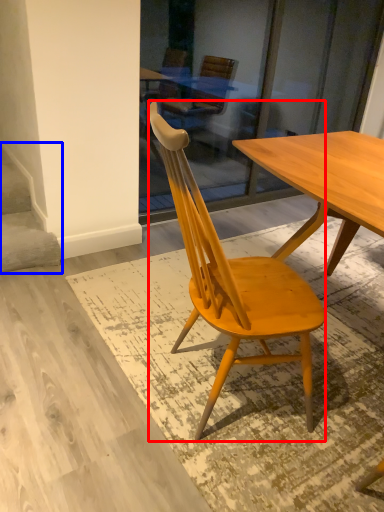
Question: Which point is closer to the camera, chair (highlighted by a red box) or stairwell (highlighted by a blue box)?

Choices:
 (A) chair
 (B) stairwell

Answer: (A)